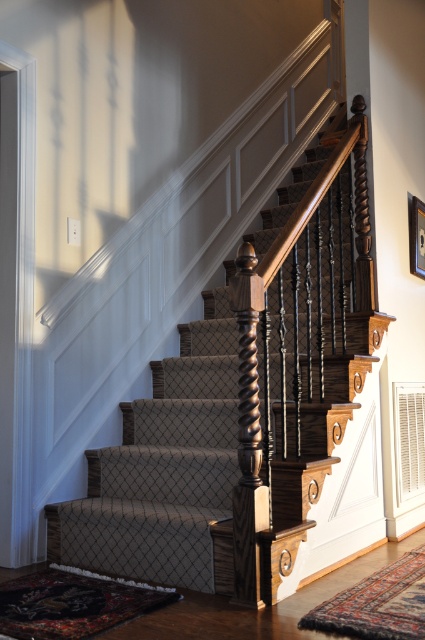
Question: Does carpeted stairs at center come in front of wooden picture frame at upper right?

Choices:
 (A) no
 (B) yes

Answer: (B)

Question: Does carpeted stairs at center appear over wooden picture frame at upper right?

Choices:
 (A) no
 (B) yes

Answer: (A)

Question: Which point is closer to the camera?

Choices:
 (A) wooden picture frame at upper right
 (B) carpeted stairs at center

Answer: (B)

Question: Observing the image, what is the correct spatial positioning of carpeted stairs at center in reference to wooden picture frame at upper right?

Choices:
 (A) below
 (B) above

Answer: (A)